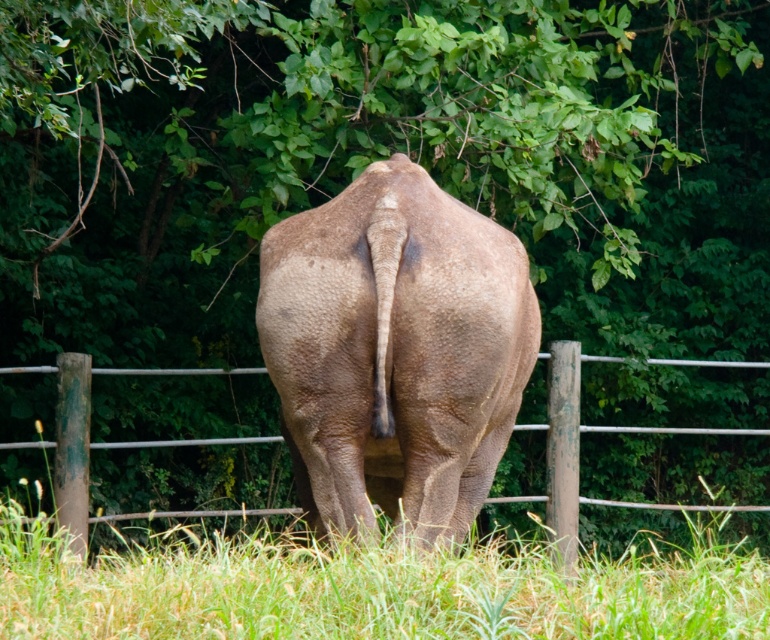
You are a wildlife photographer aiming to capture the gray textured elephant at center in your shot. The camera is currently positioned at the point with coordinates point (394, 349). Is the camera positioned directly at the gray textured elephant at center?

Yes, the point (394, 349) indicates the exact location of the gray textured elephant at center, so the camera is positioned directly at the gray textured elephant at center.

You are a photographer trying to capture the rhinoceros in the image. You notice two points marked in the scene. Which point, point 1 at coordinates (x=434, y=184) or point 2 at (x=558, y=532), is closer to you when focusing on the rhinoceros?

Point 1 at coordinates (x=434, y=184) is closer to the viewer than point 2 at (x=558, y=532).

You are a wildlife photographer trying to capture a photo of the gray textured elephant at center. You notice the brown wooden fence at center in the background. Based on their widths, which object would appear narrower in the photo?

The gray textured elephant at center is thinner than the brown wooden fence at center, so it would appear narrower in the photo.